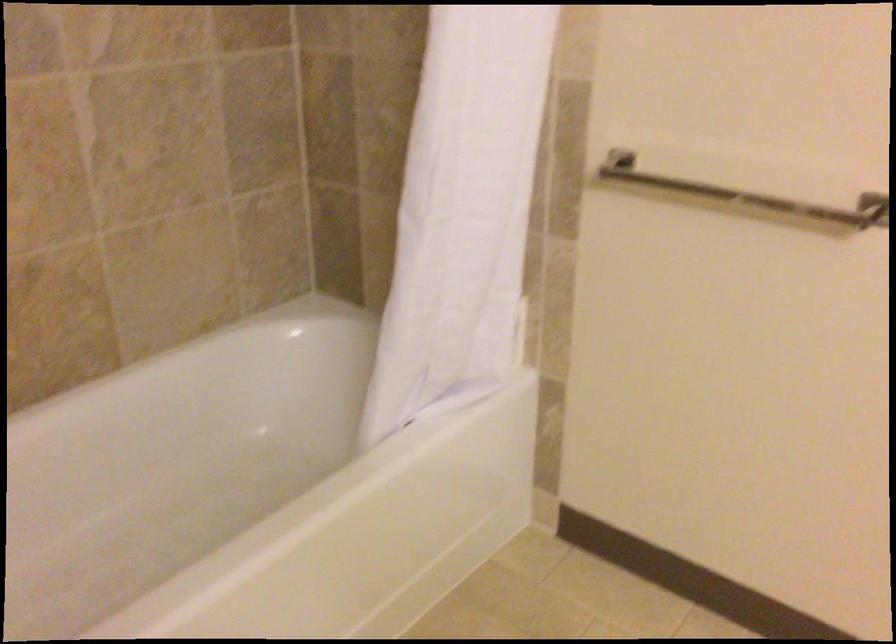
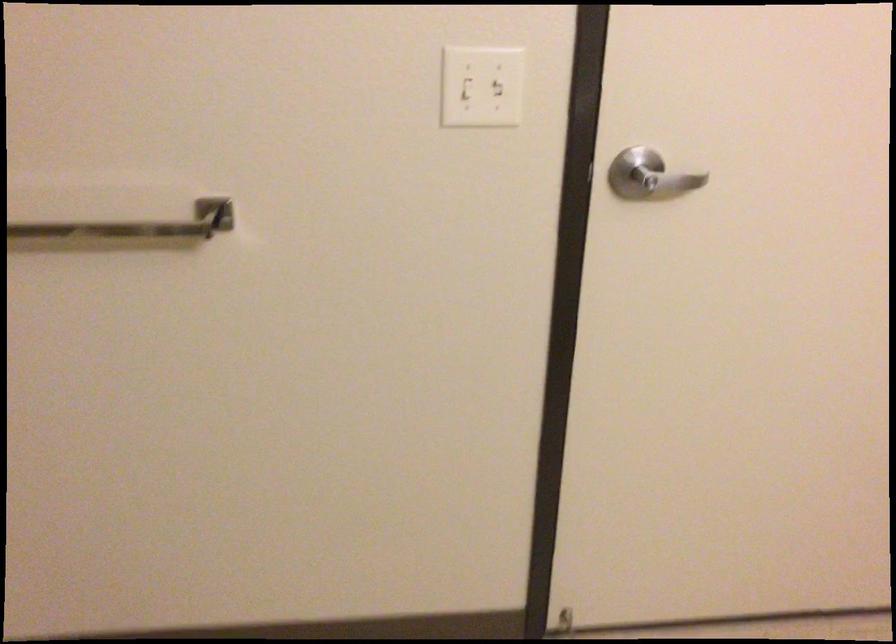
Question: How did the camera likely rotate?

Choices:
 (A) Left
 (B) Right
 (C) Up
 (D) Down

Answer: (B)